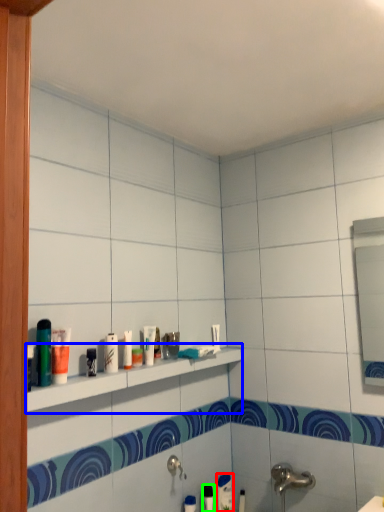
Question: Which object is the farthest from toothpaste (highlighted by a red box)? Choose among these: shelf (highlighted by a blue box) or toiletry (highlighted by a green box).

Choices:
 (A) shelf
 (B) toiletry

Answer: (A)